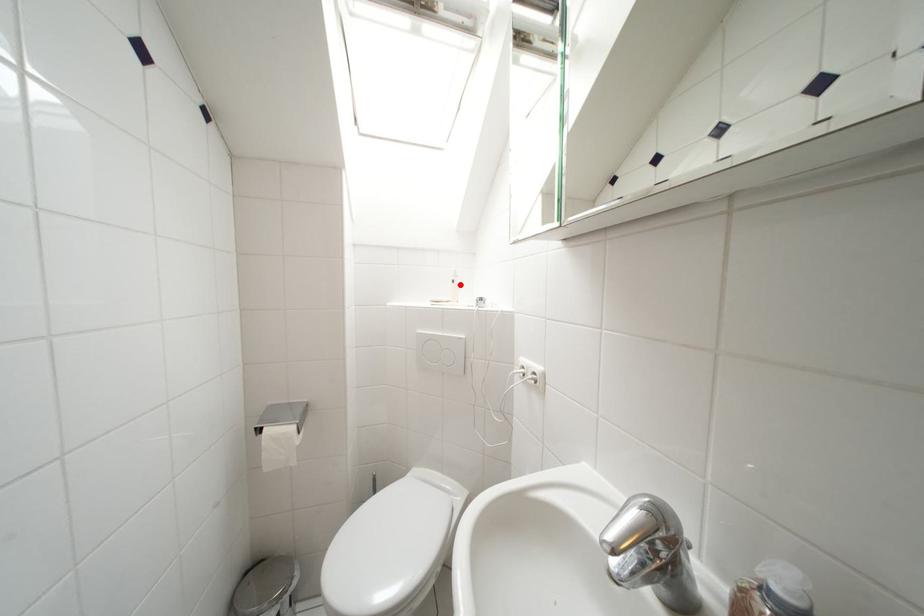
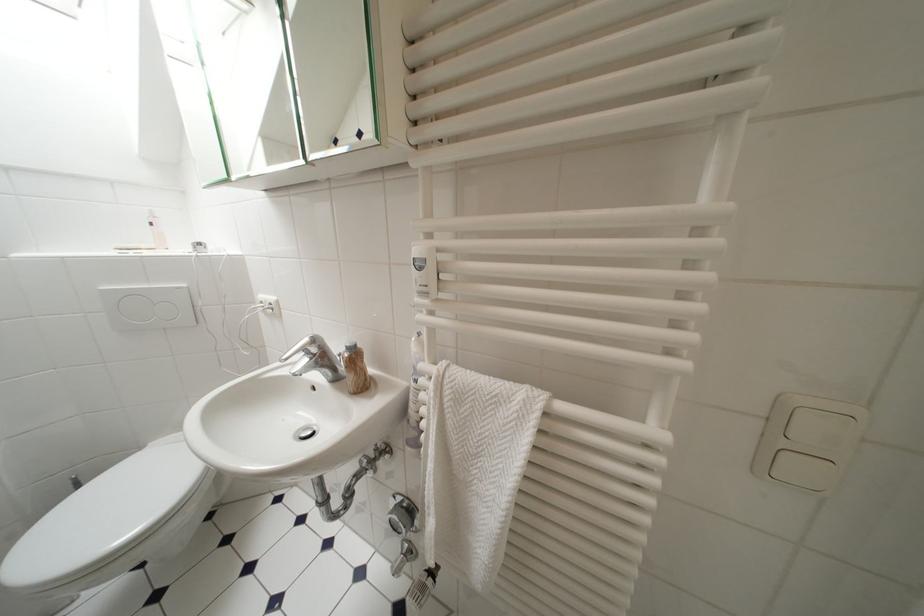
Question: I am providing you with two images of the same scene from different viewpoints. A red point is marked on the first image. Is the red point's position out of view in image 2?

Choices:
 (A) Yes
 (B) No

Answer: (B)